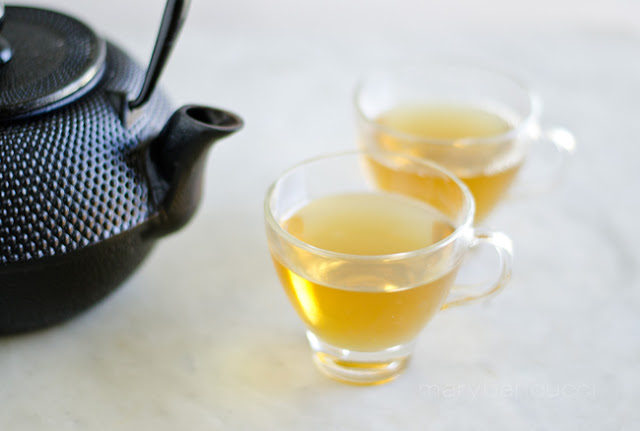
Image resolution: width=640 pixels, height=431 pixels. Find the location of `glass teacus`. glass teacus is located at coordinates (417, 255), (492, 149).